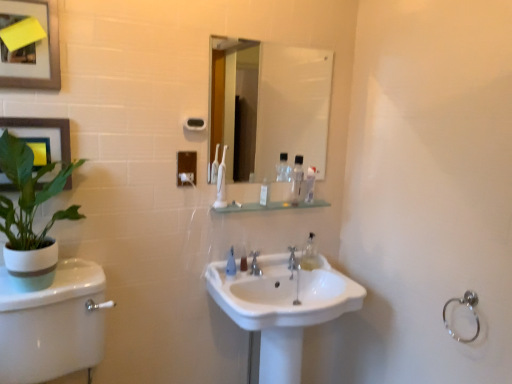
The width and height of the screenshot is (512, 384). Find the location of `matte wooden picture frame at upper left, the 2th picture frame when ordered from bottom to top`. matte wooden picture frame at upper left, the 2th picture frame when ordered from bottom to top is located at coordinates (49, 55).

The height and width of the screenshot is (384, 512). Find the location of `white plastic tube at center`. white plastic tube at center is located at coordinates (265, 192).

Describe the element at coordinates (221, 182) in the screenshot. I see `white plastic toothbrush at center` at that location.

In the scene shown: What is the approximate width of silver metallic towel bar at upper center?

It is 3.41 centimeters.

Find the location of a particular element. This screenshot has width=512, height=384. green matte plant at left is located at coordinates (30, 216).

Are silver metallic faucet at center and transparent glass shelf at center making contact?

silver metallic faucet at center and transparent glass shelf at center are not in contact.

At what (x,y) coordinates should I click in order to perform the action: click on tap below the transparent glass shelf at center (from a real-world perspective). Please return your answer as a coordinate pair (x, y). Looking at the image, I should click on (255, 264).

Can you tell me how much silver metallic faucet at center and transparent glass shelf at center differ in facing direction?

silver metallic faucet at center and transparent glass shelf at center are facing 7.27 degrees away from each other.

Is silver metallic faucet at center wider than transparent glass shelf at center?

No, silver metallic faucet at center is not wider than transparent glass shelf at center.

Considering the relative positions of white plastic toothbrush at center and white ceramic sink at center in the image provided, is white plastic toothbrush at center to the left or to the right of white ceramic sink at center?

In the image, white plastic toothbrush at center appears on the left side of white ceramic sink at center.

From the image's perspective, is white plastic toothbrush at center on white ceramic sink at center?

Yes, from the image's perspective, white plastic toothbrush at center is on top of white ceramic sink at center.

The width and height of the screenshot is (512, 384). I want to click on sink that appears on the right of white plastic toothbrush at center, so click(281, 309).

Is point (187, 128) less distant than point (301, 182)?

Yes, point (187, 128) is closer to viewer.

Does silver metallic towel bar at upper center contain clear plastic bottle at upper center, which appears as the 3th mouthwash when ordered from the bottom?

No, clear plastic bottle at upper center, which appears as the 3th mouthwash when ordered from the bottom, is located outside of silver metallic towel bar at upper center.

Looking at this image, between silver metallic towel bar at upper center and clear plastic bottle at upper center, which is the 2th mouthwash in right-to-left order, which one is positioned in front?

silver metallic towel bar at upper center.

Is silver metallic towel bar at upper center shorter than clear plastic bottle at upper center, which appears as the 3th mouthwash when ordered from the bottom?

Correct, silver metallic towel bar at upper center is not as tall as clear plastic bottle at upper center, which appears as the 3th mouthwash when ordered from the bottom.

Is point (53, 12) more distant than point (250, 273)?

No, it is not.

From a real-world perspective, which is physically above, matte wooden picture frame at upper left, positioned as the first picture frame in top-to-bottom order, or silver metallic faucet at center?

matte wooden picture frame at upper left, positioned as the first picture frame in top-to-bottom order, from a real-world perspective.

Would you say white plastic toothbrush at center is part of white glossy toilet tank at lower left's contents?

Actually, white plastic toothbrush at center is outside white glossy toilet tank at lower left.

From a real-world perspective, between white glossy toilet tank at lower left and white plastic toothbrush at center, who is vertically higher?

In real-world perspective, white plastic toothbrush at center is above.

Find the location of a particular element. This screenshot has width=512, height=384. toothbrush located above the white glossy toilet tank at lower left (from the image's perspective) is located at coordinates (221, 182).

Does silver metallic faucet at center have a smaller size compared to white plastic toothbrush at center?

Yes, silver metallic faucet at center is smaller than white plastic toothbrush at center.

Considering the relative sizes of silver metallic faucet at center and white plastic toothbrush at center in the image provided, is silver metallic faucet at center wider than white plastic toothbrush at center?

No.

From the image's perspective, is silver metallic faucet at center above white plastic toothbrush at center?

No.

Which is closer, (249, 254) or (225, 164)?

Clearly, point (249, 254) is more distant from the camera than point (225, 164).

Based on the photo, what's the angular difference between white plastic tube at center and green matte plant at left's facing directions?

There is a 0.446-degree angle between the facing directions of white plastic tube at center and green matte plant at left.

Considering the relative sizes of white plastic tube at center and green matte plant at left in the image provided, is white plastic tube at center taller than green matte plant at left?

No.

Which point is more forward, (262, 201) or (10, 174)?

Positioned in front is point (10, 174).

Based on the photo, which is correct: white plastic tube at center is inside green matte plant at left, or outside of it?

white plastic tube at center is not inside green matte plant at left, it's outside.

Where is `balustrade above the silver metallic faucet at center (from a real-world perspective)`? The height and width of the screenshot is (384, 512). balustrade above the silver metallic faucet at center (from a real-world perspective) is located at coordinates (268, 206).

In order to click on sink below the white plastic toothbrush at center (from the image's perspective) in this screenshot , I will do `click(281, 309)`.

From the image, which object appears to be farther from matte wooden picture frame at upper left, positioned as the first picture frame in top-to-bottom order, white ceramic sink at center or silver metallic towel bar at upper center?

The object further to matte wooden picture frame at upper left, positioned as the first picture frame in top-to-bottom order, is white ceramic sink at center.

Based on the photo, which object lies nearer to the anchor point silver metallic faucet at center, white plastic tube at center or green matte plant at left?

white plastic tube at center.

Looking at this image, from the image, which object appears to be farther from silver metallic towel bar at upper center, white glossy toilet tank at lower left or clear plastic bottle at upper center, which is the 1th mouthwash from top to bottom?

white glossy toilet tank at lower left is further to silver metallic towel bar at upper center.

When comparing their distances from satin nickel faucet at center, does white plastic tube at center or matte black picture frame at upper left, the 1th picture frame when ordered from bottom to top, seem closer?

white plastic tube at center.

Which object lies nearer to the anchor point transparent glass shelf at center, clear plastic bottle at upper center, which is the 1th mouthwash from top to bottom, or white ceramic sink at center?

clear plastic bottle at upper center, which is the 1th mouthwash from top to bottom, lies closer to transparent glass shelf at center than the other object.

From the picture: Looking at the image, which one is located further to transparent glass shelf at center, matte wooden picture frame at upper left, the 2th picture frame when ordered from bottom to top, or white glossy toilet tank at lower left?

matte wooden picture frame at upper left, the 2th picture frame when ordered from bottom to top, lies further to transparent glass shelf at center than the other object.

Which object lies nearer to the anchor point white ceramic sink at center, white plastic tube at center or clear plastic bottle at center, the first mouthwash in the bottom-to-top sequence?

clear plastic bottle at center, the first mouthwash in the bottom-to-top sequence.

Which object lies nearer to the anchor point white glossy mirror at upper center, matte wooden picture frame at upper left, positioned as the first picture frame in top-to-bottom order, or clear plastic bottle at upper center, arranged as the second mouthwash when viewed from the top?

Based on the image, clear plastic bottle at upper center, arranged as the second mouthwash when viewed from the top, appears to be nearer to white glossy mirror at upper center.

The width and height of the screenshot is (512, 384). Find the location of `tap between silver metallic towel bar at upper center and white ceramic sink at center in the vertical direction`. tap between silver metallic towel bar at upper center and white ceramic sink at center in the vertical direction is located at coordinates (255, 264).

You are a GUI agent. You are given a task and a screenshot of the screen. Output one action in this format:
    pyautogui.click(x=<x>, y=<y>)
    Task: Click on the sink positioned between white glossy toilet tank at lower left and white plastic toothbrush at center from near to far
    
    Given the screenshot: What is the action you would take?
    pyautogui.click(x=281, y=309)

Locate an element on the screen. This screenshot has height=384, width=512. toothbrush between white glossy toilet tank at lower left and silver metallic faucet at center from front to back is located at coordinates (221, 182).

You are a GUI agent. You are given a task and a screenshot of the screen. Output one action in this format:
    pyautogui.click(x=<x>, y=<y>)
    Task: Click on the picture frame between silver metallic towel bar at upper center and white ceramic sink at center from top to bottom
    The image size is (512, 384).
    Given the screenshot: What is the action you would take?
    pyautogui.click(x=45, y=127)